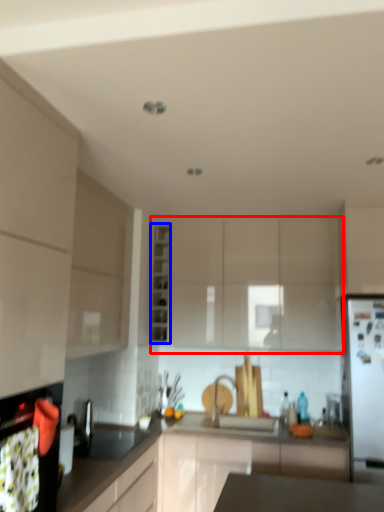
Question: Which point is further to the camera, cabinetry (highlighted by a red box) or cabinetry (highlighted by a blue box)?

Choices:
 (A) cabinetry
 (B) cabinetry

Answer: (B)